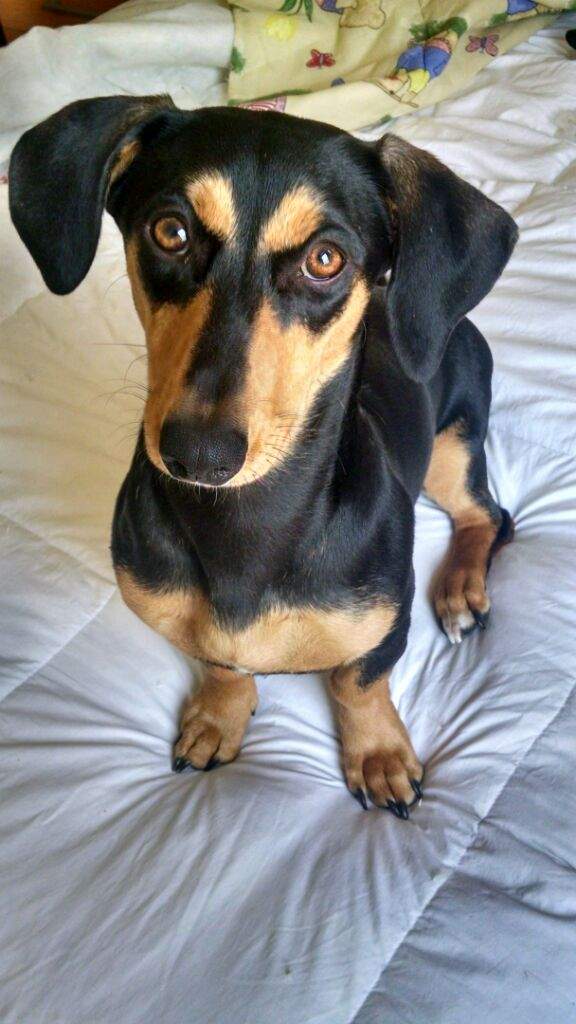
You are a GUI agent. You are given a task and a screenshot of the screen. Output one action in this format:
    pyautogui.click(x=<x>, y=<y>)
    Task: Click on the chest
    
    Given the screenshot: What is the action you would take?
    pyautogui.click(x=228, y=642)